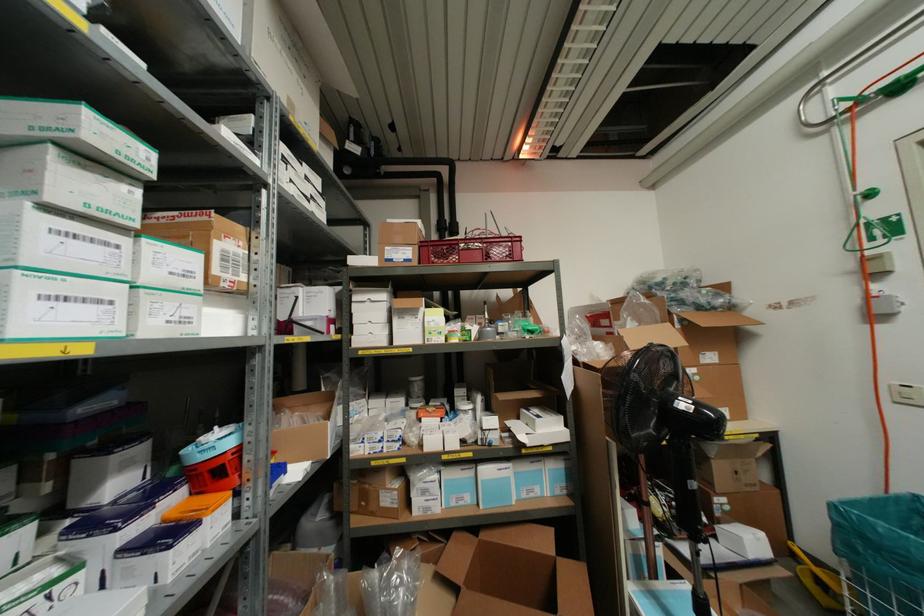
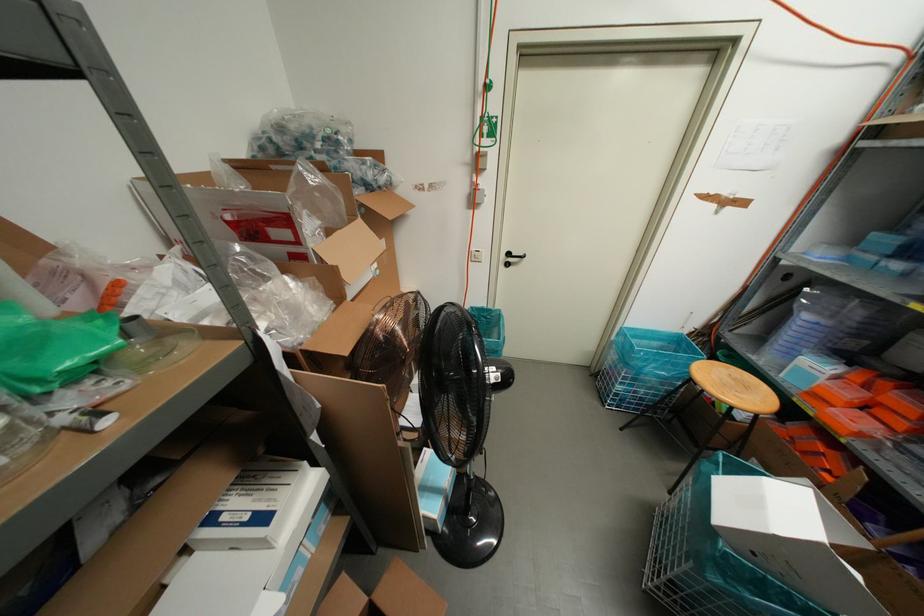
The first image is from the beginning of the video and the second image is from the end. How did the camera likely rotate when shooting the video?

The camera rotated toward right-down.